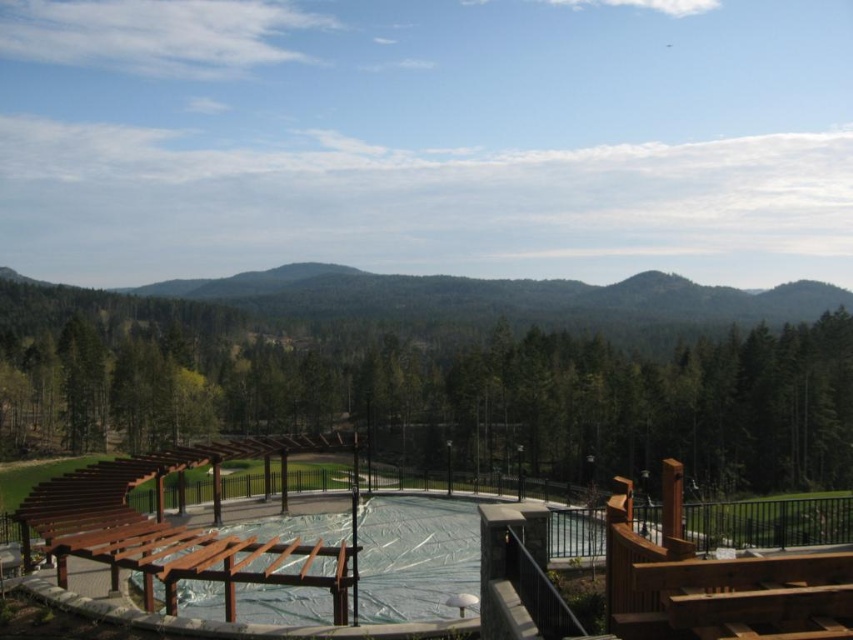
Who is higher up, green wood trees at center or brown wooden deck at center?

green wood trees at center is above.

Is green wood trees at center closer to camera compared to brown wooden deck at center?

No, green wood trees at center is further to the viewer.

Is point (180, 326) farther from viewer compared to point (634, 608)?

That is True.

You are a GUI agent. You are given a task and a screenshot of the screen. Output one action in this format:
    pyautogui.click(x=<x>, y=<y>)
    Task: Click on the green wood trees at center
    
    Given the screenshot: What is the action you would take?
    pyautogui.click(x=450, y=376)